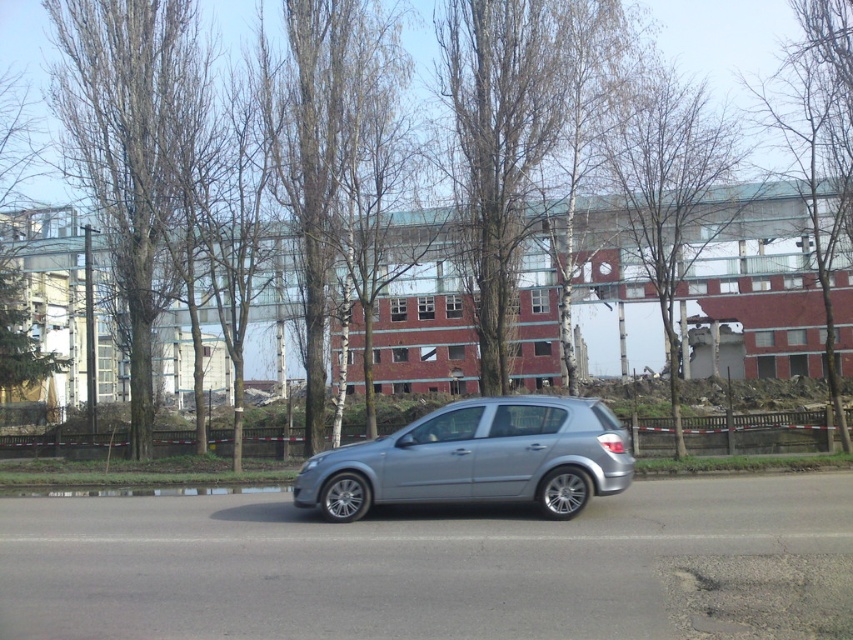
Question: Which point appears closest to the camera in this image?

Choices:
 (A) (662, 192)
 (B) (834, 209)

Answer: (A)

Question: Is satin silver car at center to the left of brown bark tree at center from the viewer's perspective?

Choices:
 (A) no
 (B) yes

Answer: (B)

Question: Does satin silver car at center have a greater width compared to smooth bark tree at upper center?

Choices:
 (A) yes
 (B) no

Answer: (B)

Question: Considering the real-world distances, which object is farthest from the brown bark tree at center?

Choices:
 (A) bare wood tree at upper right
 (B) smooth bark tree at upper center
 (C) satin silver car at center
 (D) green leafy tree at upper left

Answer: (C)

Question: In this image, where is brown bark tree at center located relative to green leafy tree at upper left?

Choices:
 (A) below
 (B) above

Answer: (B)

Question: Which object is the farthest from the bare wood tree at upper right?

Choices:
 (A) bare wood tree at left
 (B) smooth bark tree at upper center
 (C) green leafy tree at upper left

Answer: (C)